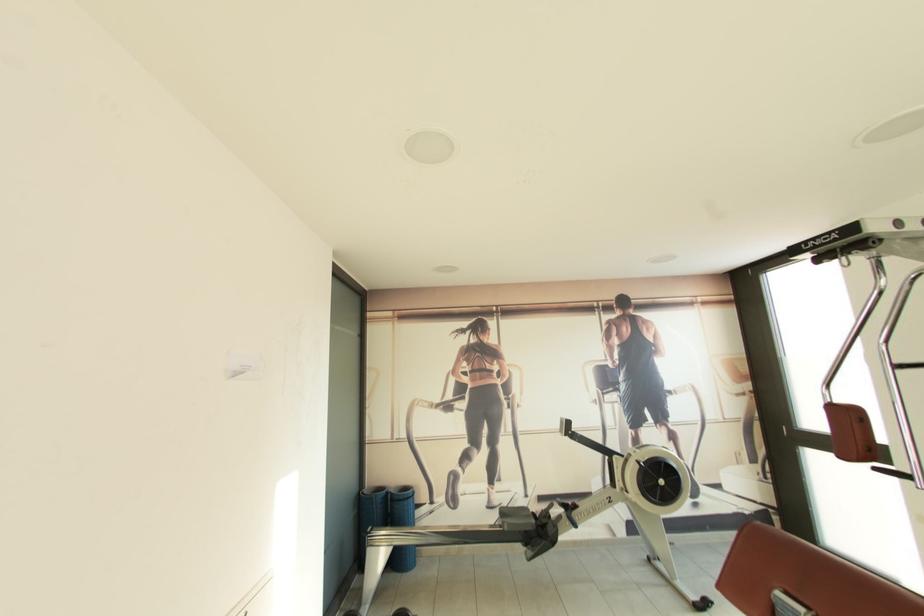
Find where to push the red machine pad. Please return your answer as a coordinate pair (x, y).

(804, 578)